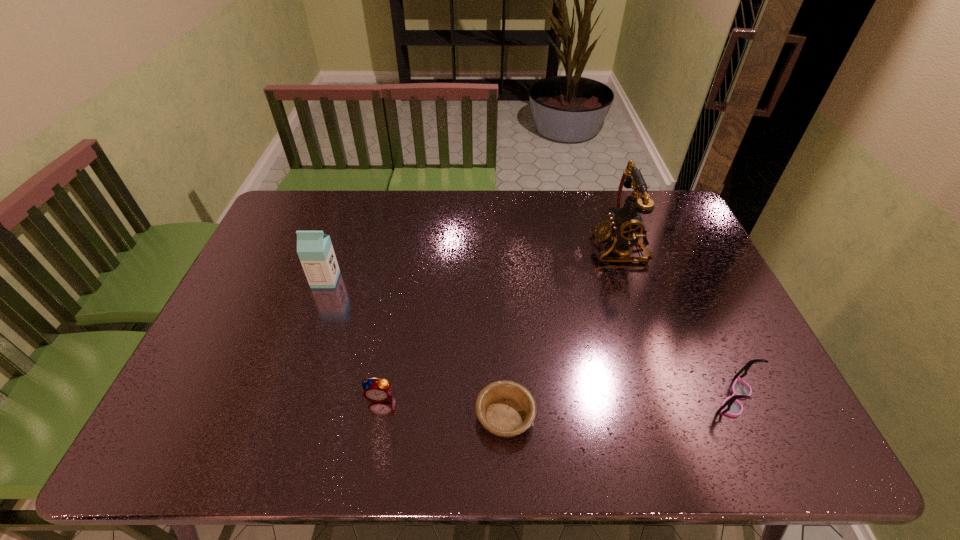
Locate an element on the screen. This screenshot has height=540, width=960. the fourth object from left to right is located at coordinates pyautogui.click(x=625, y=226).

At what (x,y) coordinates should I click in order to perform the action: click on telephone. Please return your answer as a coordinate pair (x, y). Looking at the image, I should click on (625, 226).

Where is `the second tallest object`? This screenshot has width=960, height=540. the second tallest object is located at coordinates (314, 248).

Locate an element on the screen. the leftmost object is located at coordinates (314, 248).

Locate an element on the screen. The height and width of the screenshot is (540, 960). spectacles is located at coordinates (731, 406).

Where is `alarm clock`? This screenshot has width=960, height=540. alarm clock is located at coordinates (377, 390).

You are a GUI agent. You are given a task and a screenshot of the screen. Output one action in this format:
    pyautogui.click(x=<x>, y=<y>)
    Task: Click on the second object from left to right
    The width and height of the screenshot is (960, 540).
    Given the screenshot: What is the action you would take?
    pyautogui.click(x=377, y=390)

In order to click on the shortest object in this screenshot , I will do `click(505, 408)`.

Locate an element on the screen. Image resolution: width=960 pixels, height=540 pixels. the third object from right to left is located at coordinates (505, 408).

Locate an element on the screen. The image size is (960, 540). free region located 0.170m on the front of the second object from right to left, featuring the rotary dial is located at coordinates (540, 247).